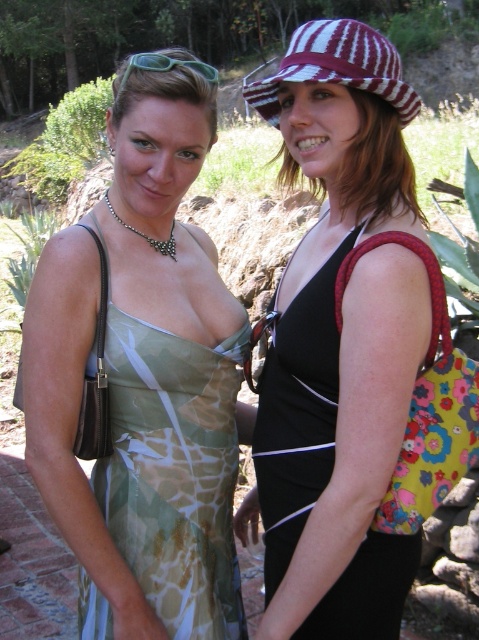
Is printed fabric dress at left below maroon and white striped fabric hat at upper right?

Indeed, printed fabric dress at left is positioned under maroon and white striped fabric hat at upper right.

Is point (228, 604) closer to viewer compared to point (265, 109)?

No, it is behind (265, 109).

Identify the location of printed fabric dress at left. (x=144, y=376).

The width and height of the screenshot is (479, 640). I want to click on black matte dress at center, so click(x=339, y=342).

Find the location of a particular element. Image resolution: width=479 pixels, height=640 pixels. black matte dress at center is located at coordinates (339, 342).

Does printed fabric dress at left appear on the left side of black matte dress at center?

Correct, you'll find printed fabric dress at left to the left of black matte dress at center.

Measure the distance between printed fabric dress at left and camera.

They are 4.92 feet apart.

I want to click on printed fabric dress at left, so click(x=144, y=376).